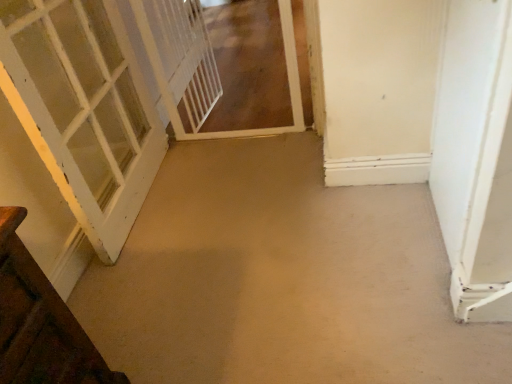
Question: From the image's perspective, is white painted wood door at left, which is the third door in right-to-left order, above or below white matte door at right, the 1th door when ordered from right to left?

Choices:
 (A) above
 (B) below

Answer: (A)

Question: From a real-world perspective, is white painted wood door at left, marked as the first door in a left-to-right arrangement, above or below white matte door at right, the 1th door when ordered from right to left?

Choices:
 (A) below
 (B) above

Answer: (B)

Question: Which object is the closest to the white painted wood door at left, marked as the first door in a left-to-right arrangement?

Choices:
 (A) beige carpet at center
 (B) white matte door at right, the 1th door when ordered from right to left
 (C) wooden door at lower left, acting as the 2th door starting from the right
 (D) white mesh screen door at center, which is the second screen door from right to left
 (E) white mesh screen door at upper left, the 1th screen door viewed from the right

Answer: (D)

Question: Estimate the real-world distances between objects in this image. Which object is farther from the white mesh screen door at upper left, acting as the second screen door starting from the left?

Choices:
 (A) beige carpet at center
 (B) white mesh screen door at center, which is the second screen door from right to left
 (C) white matte door at right, which is counted as the 3th door, starting from the left
 (D) white painted wood door at left, marked as the first door in a left-to-right arrangement
 (E) wooden door at lower left, acting as the 2th door starting from the right

Answer: (E)